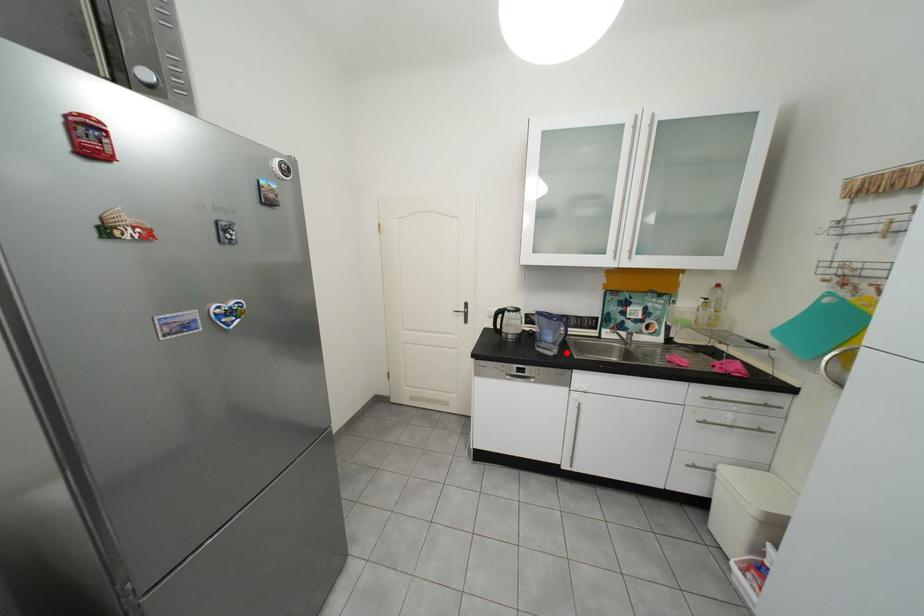
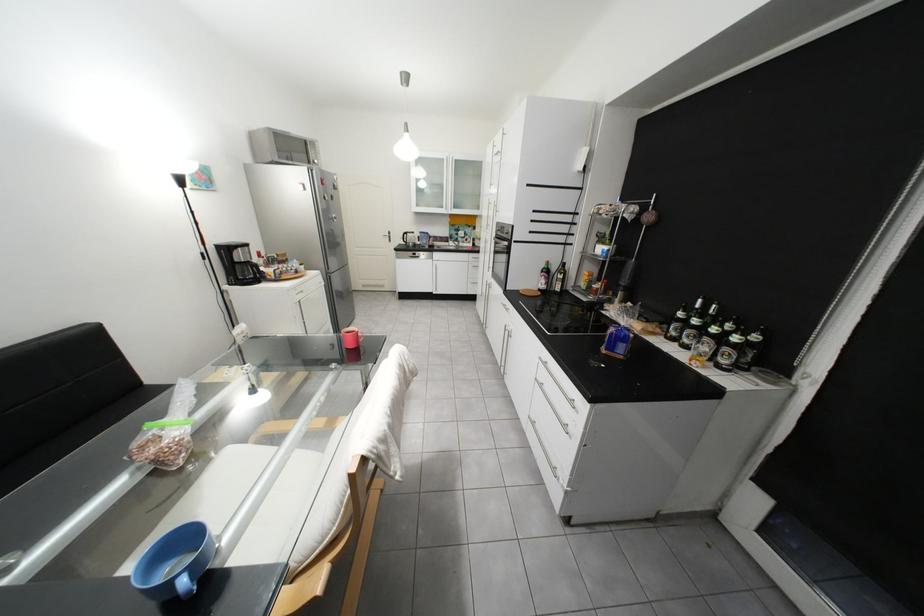
Find the pixel in the second image that matches the highlighted location in the first image.

(439, 248)